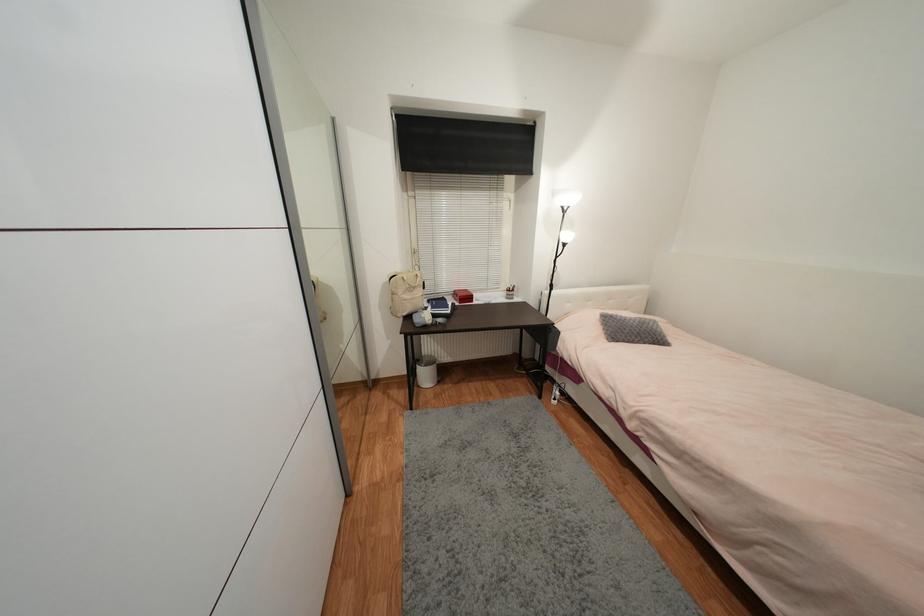
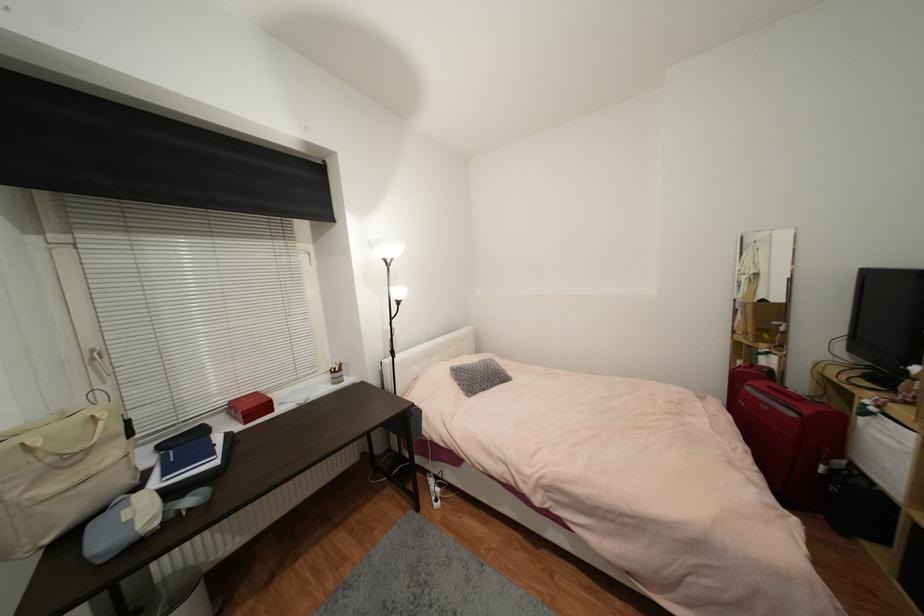
Question: The camera is either moving clockwise (left) or counter-clockwise (right) around the object. The first image is from the beginning of the video and the second image is from the end. Is the camera moving left or right when shooting the video?

Choices:
 (A) Left
 (B) Right

Answer: (A)